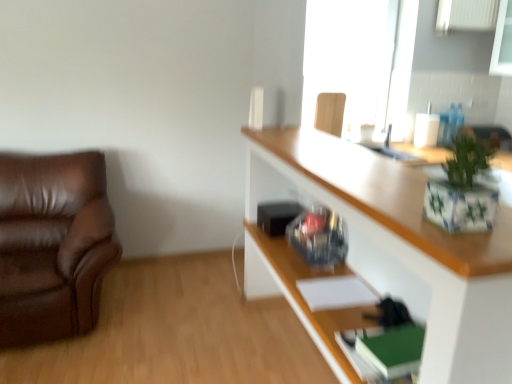
Find the location of `unoccupied space behind green ceramic pot at upper right`. unoccupied space behind green ceramic pot at upper right is located at coordinates (396, 195).